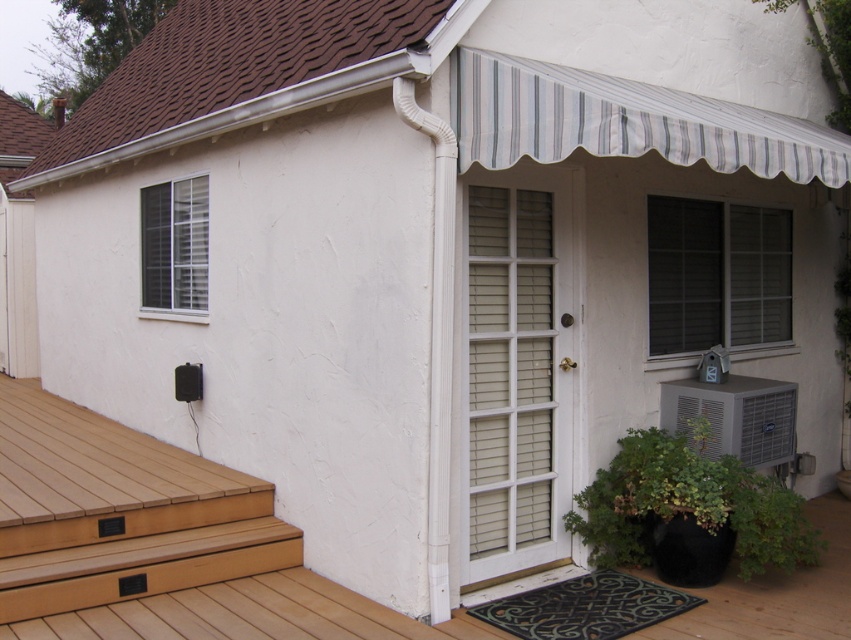
Does white textured shutter at right have a larger size compared to light brown wood stairs at lower left?

Indeed, white textured shutter at right has a larger size compared to light brown wood stairs at lower left.

Who is more distant from viewer, (x=672, y=248) or (x=273, y=516)?

Positioned behind is point (x=672, y=248).

Does point (743, 228) come behind point (26, 609)?

That is True.

The width and height of the screenshot is (851, 640). In order to click on white textured shutter at right in this screenshot , I will do `click(717, 275)`.

Does white textured screen door at center come in front of white textured air conditioner at lower right?

Yes, white textured screen door at center is in front of white textured air conditioner at lower right.

Can you confirm if white textured screen door at center is bigger than white textured air conditioner at lower right?

Yes, white textured screen door at center is bigger than white textured air conditioner at lower right.

Identify the location of white textured screen door at center. The width and height of the screenshot is (851, 640). (518, 371).

You are a GUI agent. You are given a task and a screenshot of the screen. Output one action in this format:
    pyautogui.click(x=<x>, y=<y>)
    Task: Click on the white textured screen door at center
    This screenshot has height=640, width=851.
    Given the screenshot: What is the action you would take?
    pyautogui.click(x=518, y=371)

Between point (190, 577) and point (678, 387), which one is positioned behind?

The point (678, 387) is behind.

What do you see at coordinates (141, 566) in the screenshot? I see `light brown wood stairs at lower left` at bounding box center [141, 566].

Is point (0, 582) positioned behind point (757, 422)?

No, it is not.

Where is `light brown wood stairs at lower left`? Image resolution: width=851 pixels, height=640 pixels. light brown wood stairs at lower left is located at coordinates (141, 566).